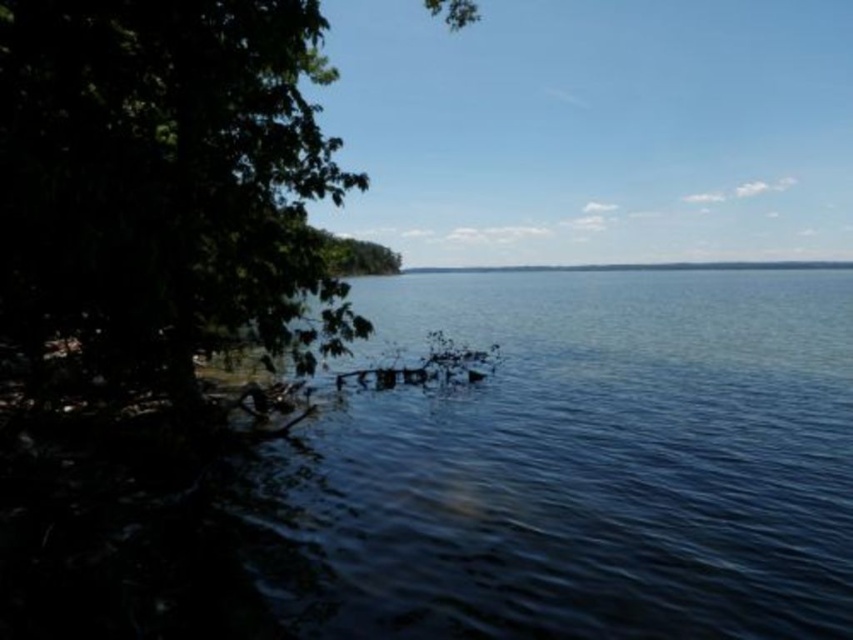
Is green leafy tree at left above green leafy tree at center?

No, green leafy tree at left is not above green leafy tree at center.

Is green leafy tree at left further to the viewer compared to green leafy tree at center?

That is False.

Locate an element on the screen. The height and width of the screenshot is (640, 853). green leafy tree at left is located at coordinates (165, 182).

Locate an element on the screen. green leafy tree at left is located at coordinates (165, 182).